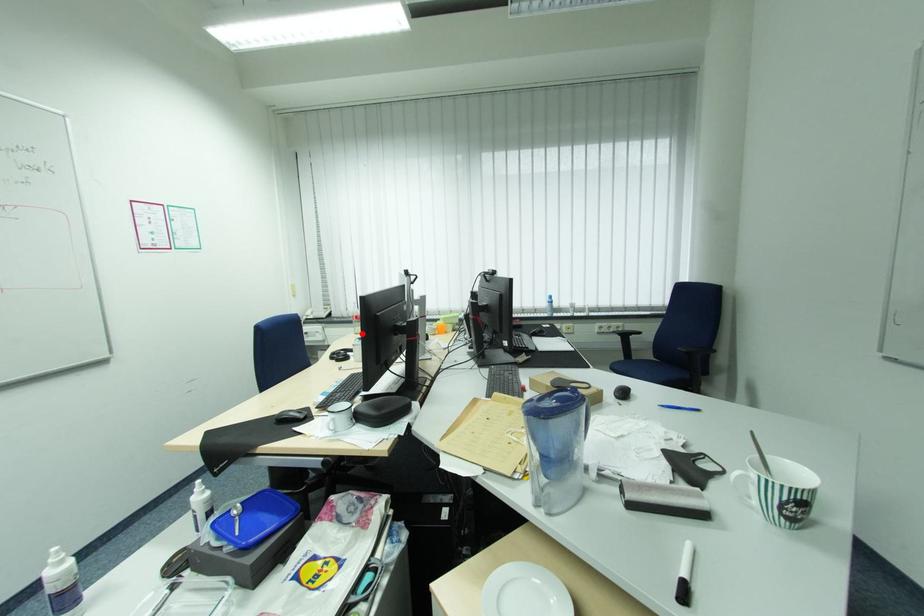
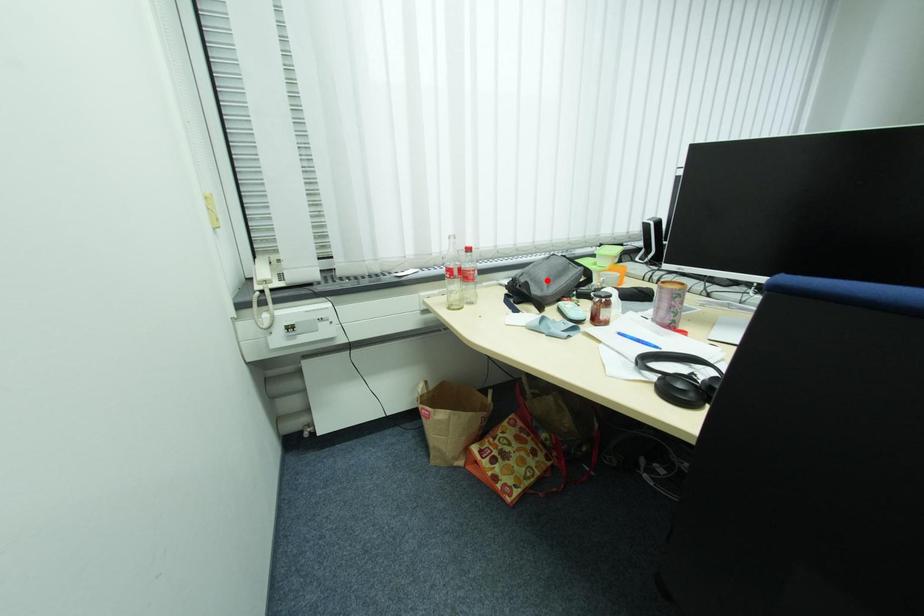
I am providing you with two images of the same scene from different viewpoints. A red point is marked on the first image and another point is marked on the second image. Do the highlighted points in image1 and image2 indicate the same real-world spot?

No